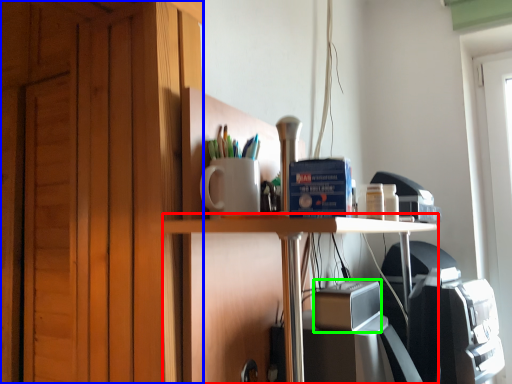
Question: Estimate the real-world distances between objects in this image. Which object is closer to table (highlighted by a red box), dresser (highlighted by a blue box) or appliance (highlighted by a green box)?

Choices:
 (A) dresser
 (B) appliance

Answer: (B)